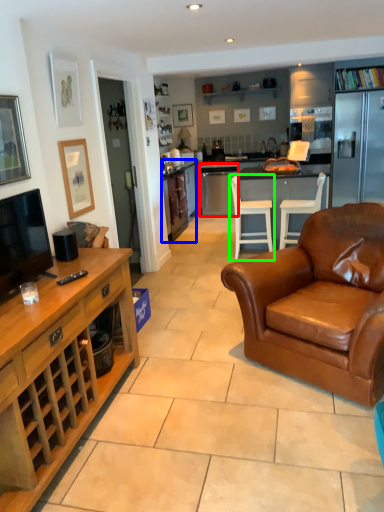
Question: Considering the real-world distances, which object is closest to kitchen appliance (highlighted by a red box)? cabinetry (highlighted by a blue box) or chair (highlighted by a green box).

Choices:
 (A) cabinetry
 (B) chair

Answer: (A)